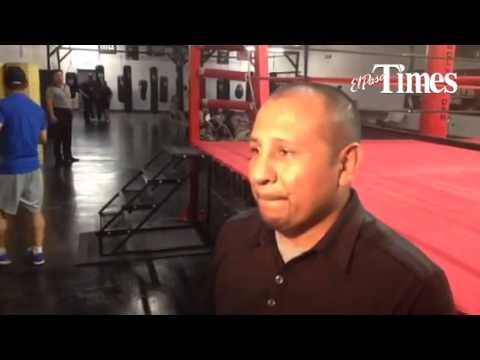
Find the location of `top black stair`. top black stair is located at coordinates (182, 149).